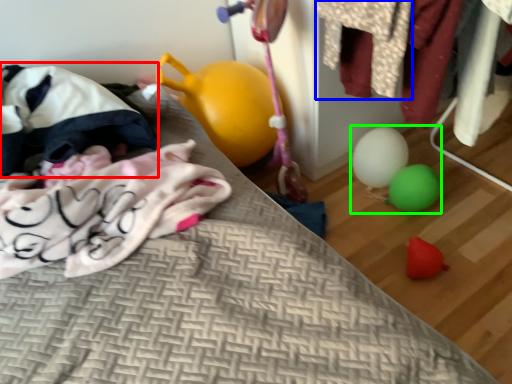
Question: Which is farther away from bean bag chair (highlighted by a red box)? clothing (highlighted by a blue box) or toy (highlighted by a green box)?

Choices:
 (A) clothing
 (B) toy

Answer: (B)